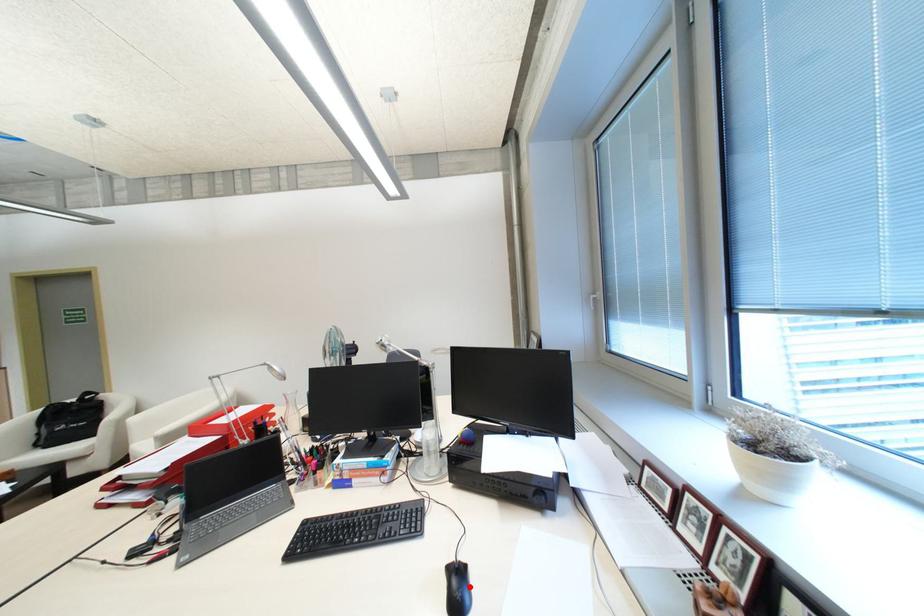
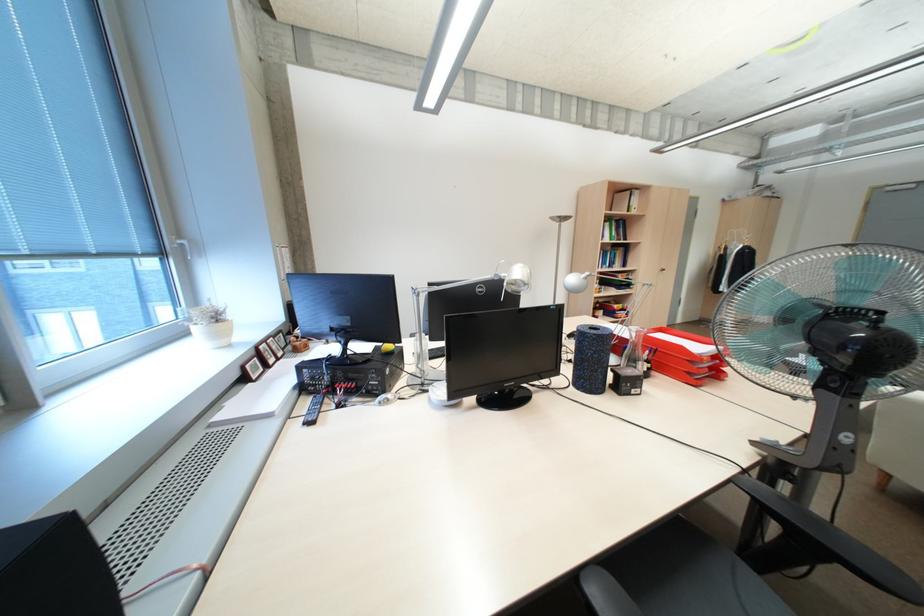
Question: I am providing you with two images of the same scene from different viewpoints. A red point is marked on the first image. At the location where the point appears in image 1, is it still visible in image 2?

Choices:
 (A) Yes
 (B) No

Answer: (B)